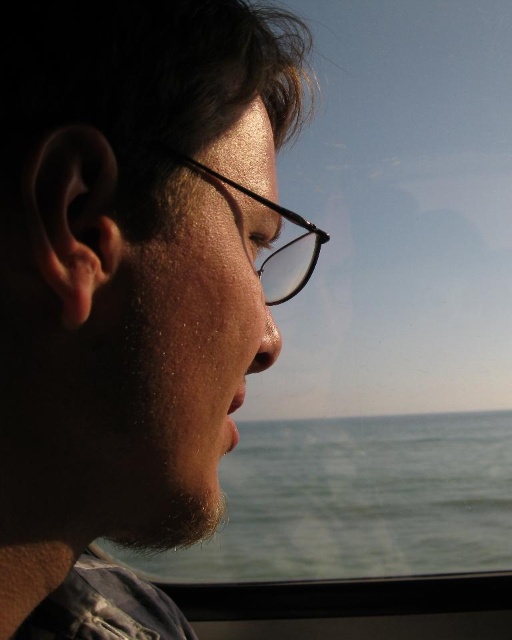
Question: Which of the following is the farthest from the observer?

Choices:
 (A) (414, 513)
 (B) (314, 259)

Answer: (A)

Question: Among these objects, which one is nearest to the camera?

Choices:
 (A) matte black glasses at center
 (B) olive green water at lower center
 (C) black plastic glasses at center

Answer: (A)

Question: Which of the following is the farthest from the observer?

Choices:
 (A) black plastic glasses at center
 (B) olive green water at lower center

Answer: (B)

Question: Is olive green water at lower center above black plastic glasses at center?

Choices:
 (A) no
 (B) yes

Answer: (A)

Question: Can you confirm if olive green water at lower center is positioned to the left of black plastic glasses at center?

Choices:
 (A) yes
 (B) no

Answer: (B)

Question: Does matte black glasses at center come in front of black plastic glasses at center?

Choices:
 (A) yes
 (B) no

Answer: (A)